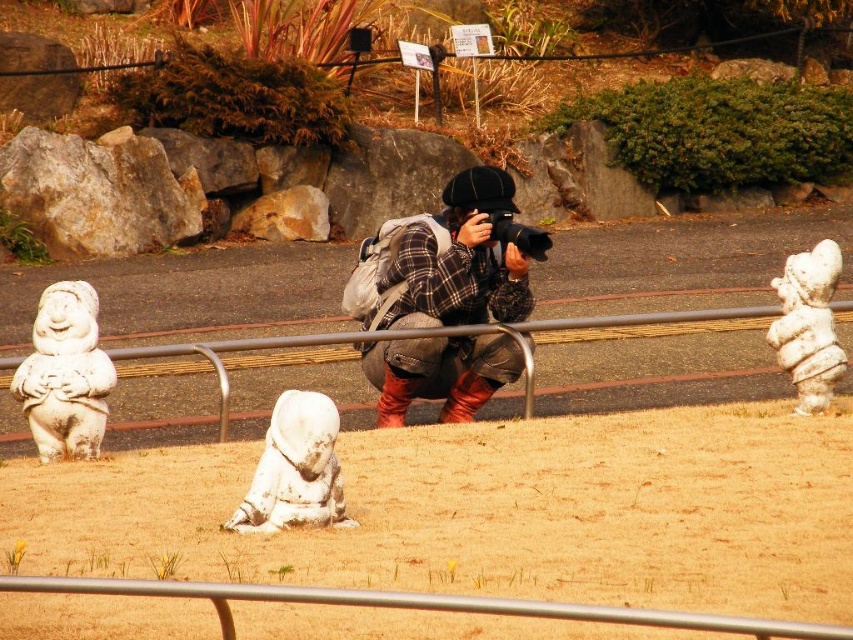
Question: Does plaid fabric camera at center appear on the right side of metallic silver rail at lower center?

Choices:
 (A) no
 (B) yes

Answer: (B)

Question: Which of the following is the farthest from the observer?

Choices:
 (A) white stone statue at center
 (B) brushed metal rail at center

Answer: (B)

Question: Which point is closer to the camera?

Choices:
 (A) white stone statue at right
 (B) brushed metal rail at center
 (C) metallic silver rail at lower center
 (D) white stone statue at center

Answer: (C)

Question: Based on their relative distances, which object is nearer to the white stone sculpture at left?

Choices:
 (A) white stone statue at center
 (B) metallic silver rail at lower center
 (C) white stone statue at right
 (D) brushed metal rail at center

Answer: (D)

Question: Can you confirm if metallic silver rail at lower center is smaller than white stone statue at center?

Choices:
 (A) yes
 (B) no

Answer: (B)

Question: Can you confirm if plaid fabric camera at center is positioned below white stone statue at right?

Choices:
 (A) no
 (B) yes

Answer: (A)